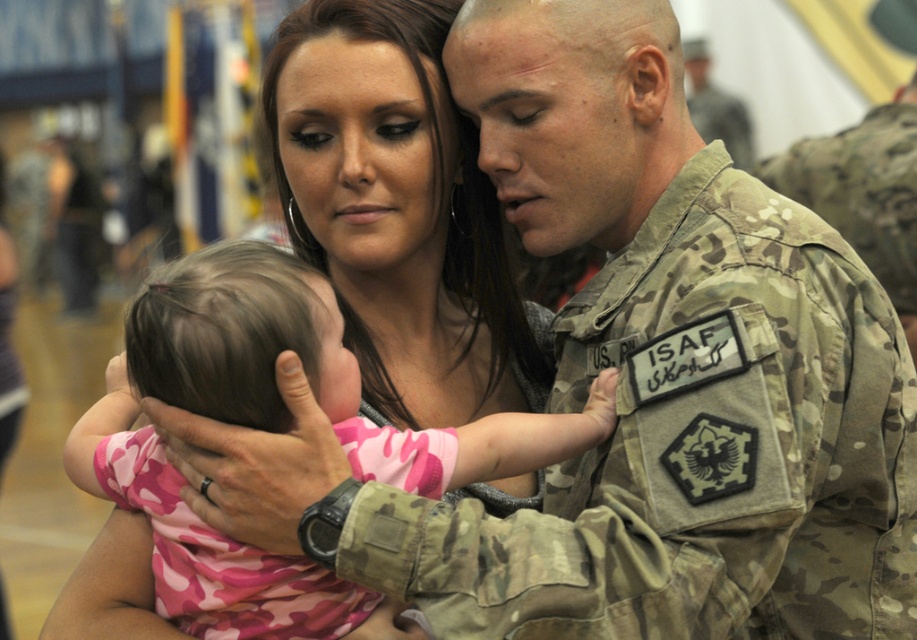
Question: Among these objects, which one is farthest from the camera?

Choices:
 (A) camouflage fabric uniform at center
 (B) pink camouflage shirt at center
 (C) camouflage uniform at center

Answer: (C)

Question: Is camouflage fabric uniform at center below camouflage uniform at center?

Choices:
 (A) no
 (B) yes

Answer: (B)

Question: Which of the following is the closest to the observer?

Choices:
 (A) camouflage uniform at center
 (B) pink camouflage shirt at center

Answer: (B)

Question: Can you confirm if pink camouflage shirt at center is positioned to the left of camouflage uniform at center?

Choices:
 (A) no
 (B) yes

Answer: (B)

Question: Is pink camouflage shirt at center below camouflage uniform at center?

Choices:
 (A) yes
 (B) no

Answer: (A)

Question: Which is farther from the camouflage fabric uniform at center?

Choices:
 (A) camouflage uniform at center
 (B) pink camouflage shirt at center

Answer: (A)